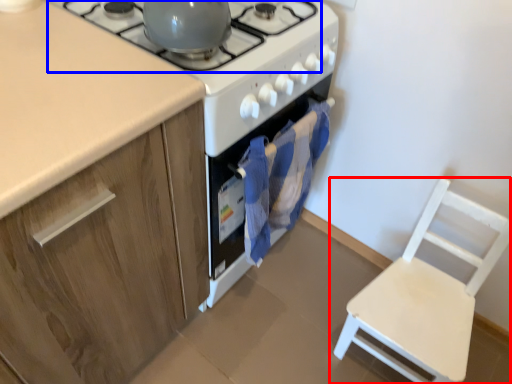
Question: Which of the following is the farthest to the observer, chair (highlighted by a red box) or gas stove (highlighted by a blue box)?

Choices:
 (A) chair
 (B) gas stove

Answer: (A)